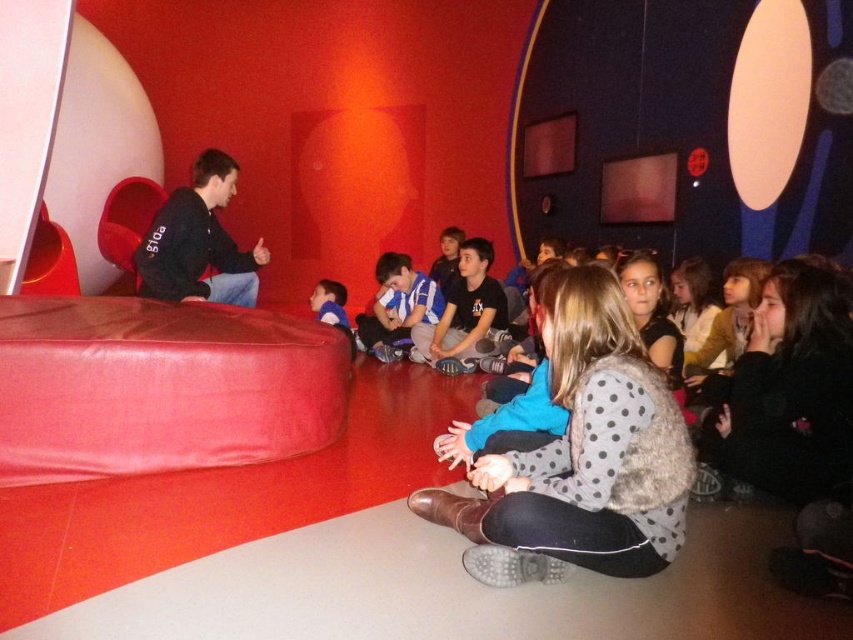
Does smooth red bean bag at left come behind polka dot sweater at center?

That is True.

Is point (30, 307) positioned in front of point (630, 458)?

No, it is not.

At what (x,y) coordinates should I click in order to perform the action: click on smooth red bean bag at left. Please return your answer as a coordinate pair (x, y). Looking at the image, I should click on (160, 387).

Does point (622, 445) lie behind point (222, 272)?

No, (622, 445) is in front of (222, 272).

Where is `polka dot sweater at center`? Image resolution: width=853 pixels, height=640 pixels. polka dot sweater at center is located at coordinates (581, 456).

Is smooth red bean bag at left positioned at the back of matte black sweater at left?

That is False.

Is point (213, 310) positioned in front of point (263, 253)?

Yes, it is in front of point (263, 253).

What do you see at coordinates (160, 387) in the screenshot?
I see `smooth red bean bag at left` at bounding box center [160, 387].

Image resolution: width=853 pixels, height=640 pixels. What are the coordinates of `smooth red bean bag at left` in the screenshot? It's located at (160, 387).